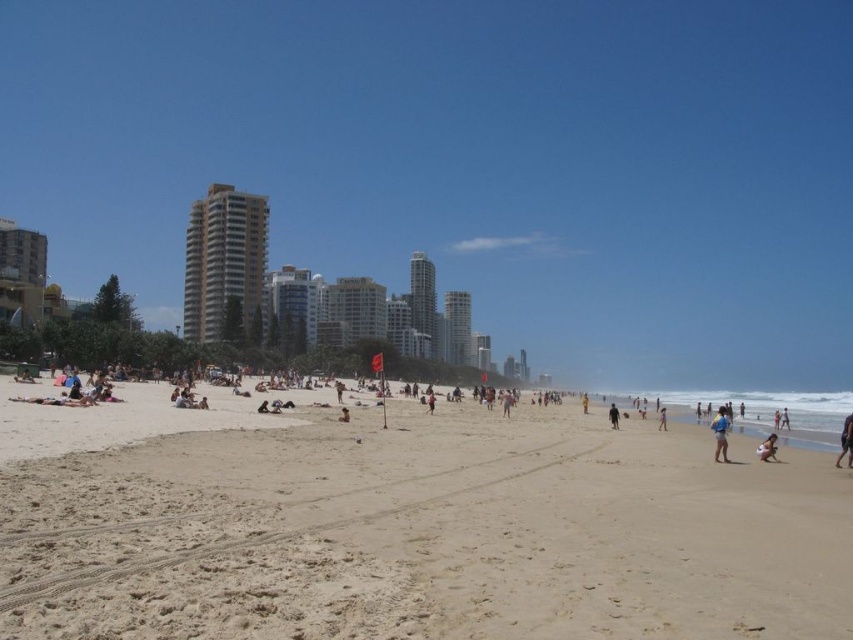
Looking at this image, you are standing on the beach and see the purple fabric at lower right. Where exactly is it located in terms of coordinates?

The purple fabric at lower right is located at point [845,442].

You are a beachgoer who wants to place your brown textured surfboard at center on the sand. However, you notice that the light brown sand at center is covering part of it. Where should you move the surfboard so it is fully visible?

The light brown sand at center is positioned over the brown textured surfboard at center. To make the surfboard fully visible, move it to an area where the sand is not covering it, such as to the left or right of the current position.